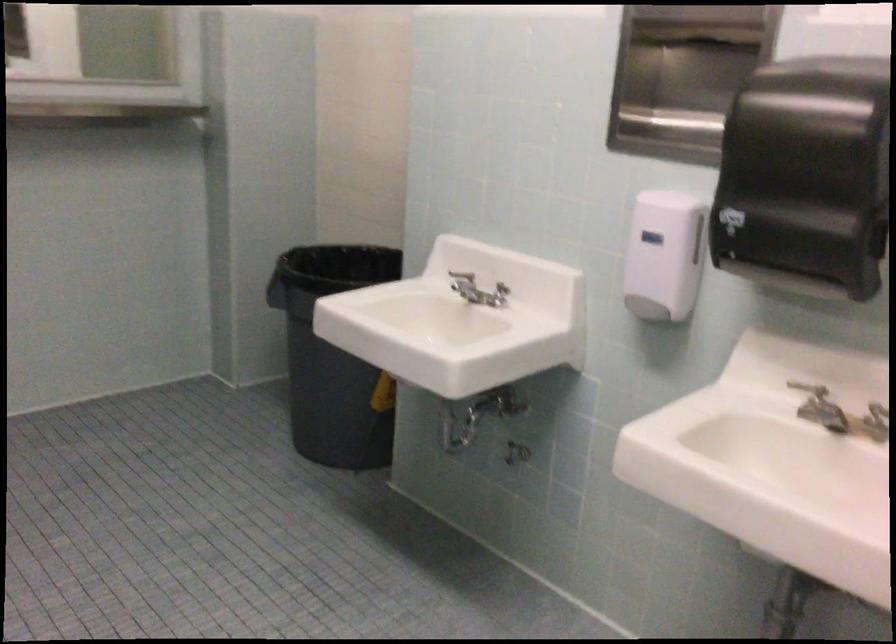
Find where to push the soap dispenser pump. Please return your answer as a coordinate pair (x, y).

(653, 310)